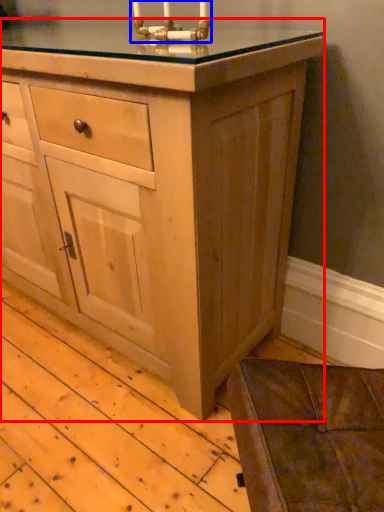
Question: Among these objects, which one is farthest to the camera, chest of drawers (highlighted by a red box) or candle holder (highlighted by a blue box)?

Choices:
 (A) chest of drawers
 (B) candle holder

Answer: (B)